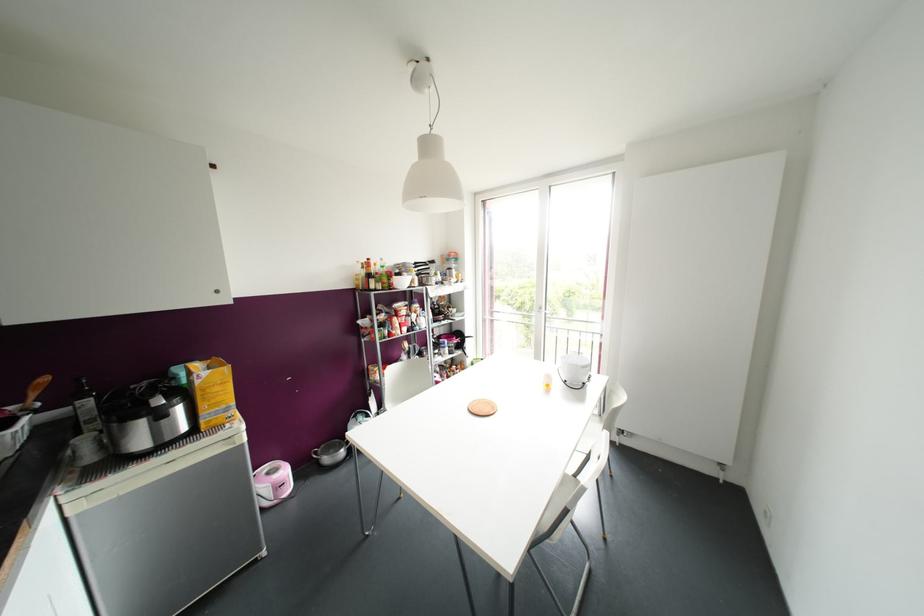
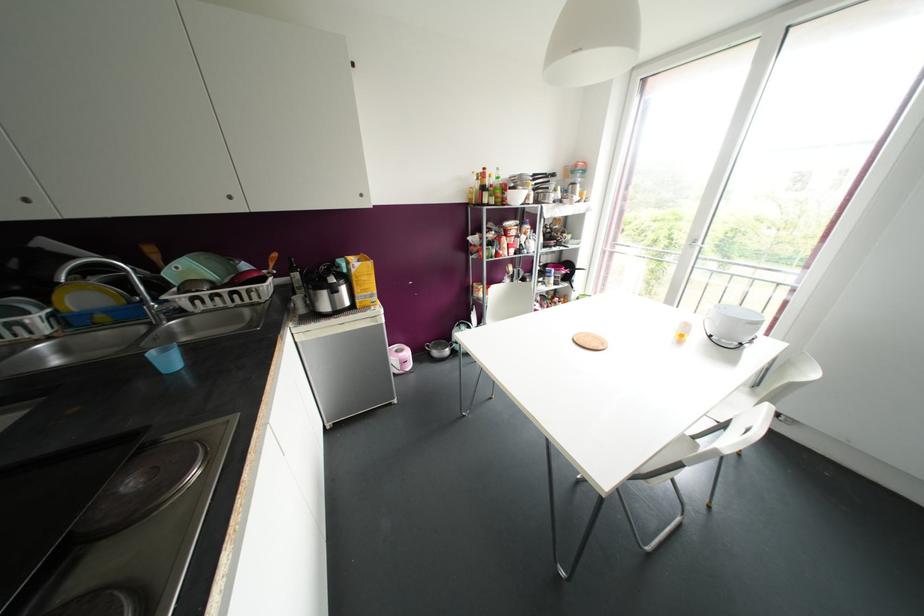
In the second image, find the point that corresponds to the point at 546,385 in the first image.

(681, 334)